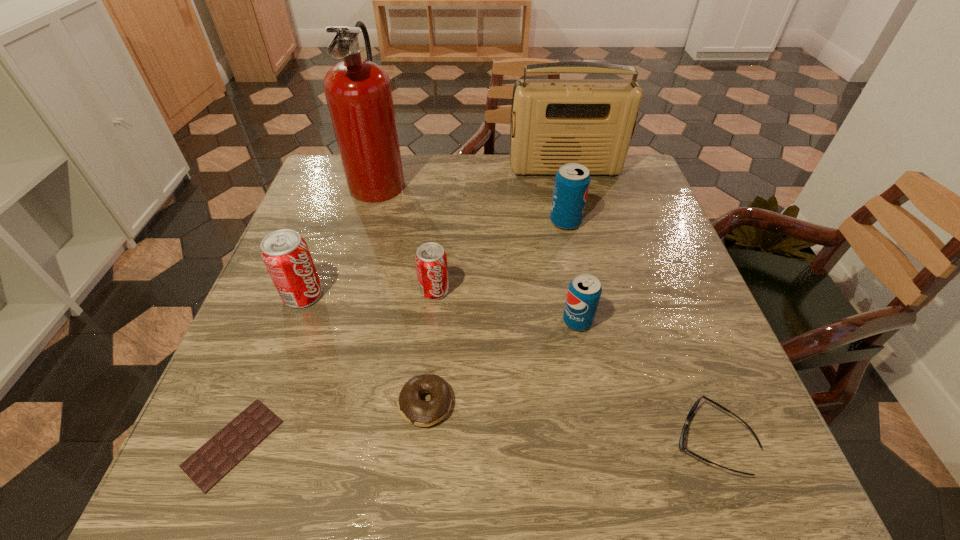
The image size is (960, 540). I want to click on vacant space at the left edge, so click(x=322, y=248).

The image size is (960, 540). Find the location of `vacant space at the right edge`. vacant space at the right edge is located at coordinates (687, 345).

Where is `vacant area at the far left corner of the desktop`? The height and width of the screenshot is (540, 960). vacant area at the far left corner of the desktop is located at coordinates (342, 170).

Find the location of a particular element. This screenshot has width=960, height=540. free location at the near left corner is located at coordinates (268, 483).

This screenshot has height=540, width=960. I want to click on vacant area at the far right corner of the desktop, so click(x=604, y=194).

The width and height of the screenshot is (960, 540). I want to click on vacant area at the near right corner, so click(x=741, y=461).

Where is `free space between the right red soda can and the beige radio receiver`? This screenshot has width=960, height=540. free space between the right red soda can and the beige radio receiver is located at coordinates (500, 230).

Find the location of a particular element. The height and width of the screenshot is (540, 960). free space between the left red soda can and the radio receiver is located at coordinates (434, 232).

You are a GUI agent. You are given a task and a screenshot of the screen. Output one action in this format:
    pyautogui.click(x=<x>, y=<y>)
    Task: Click on the empty location between the chocolate bar and the leftmost soda can
    
    Given the screenshot: What is the action you would take?
    pyautogui.click(x=268, y=369)

Where is `unoccupied area between the second soda can from left to right and the radio receiver`? This screenshot has height=540, width=960. unoccupied area between the second soda can from left to right and the radio receiver is located at coordinates (500, 230).